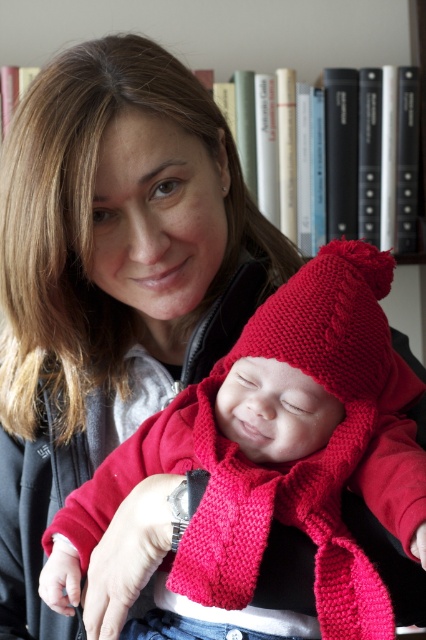
Identify the location of knitted red hat at center. Image resolution: width=426 pixels, height=640 pixels. (273, 464).

Between point (294, 456) and point (339, 24), which one is positioned in front?

Positioned in front is point (294, 456).

Is point (195, 515) behind point (409, 316)?

That is False.

Find the location of `knitted red hat at center`. knitted red hat at center is located at coordinates (273, 464).